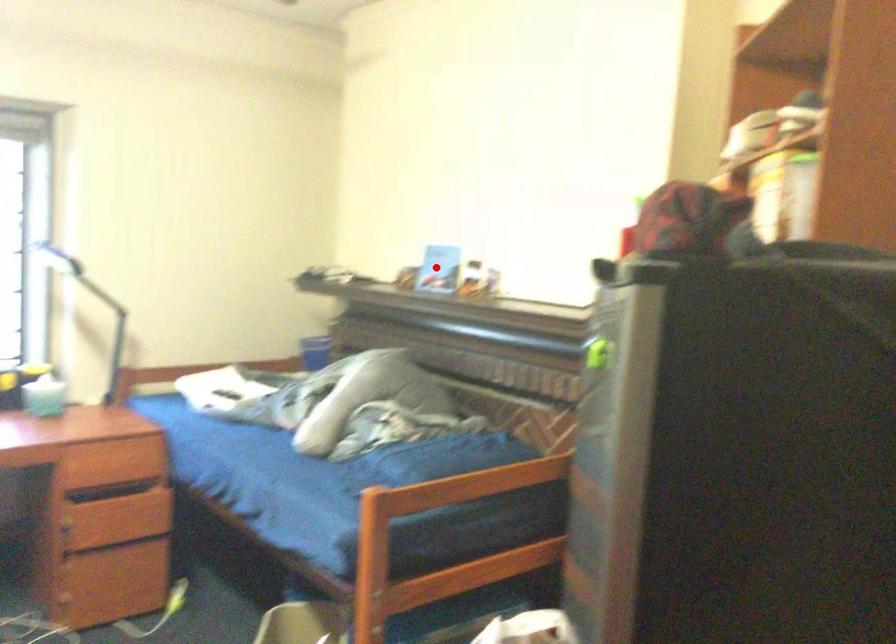
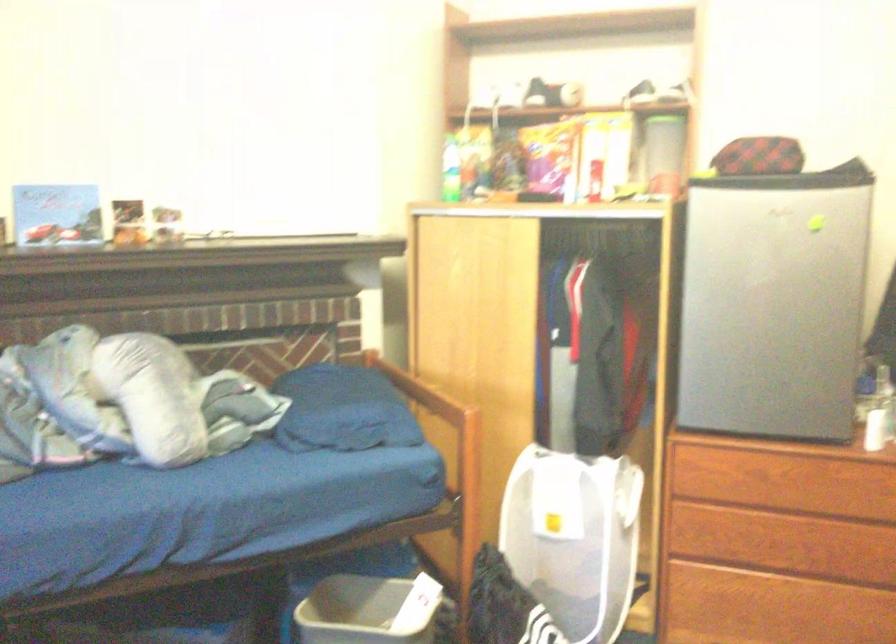
The point at the highlighted location is marked in the first image. Where is the corresponding point in the second image?

(56, 214)